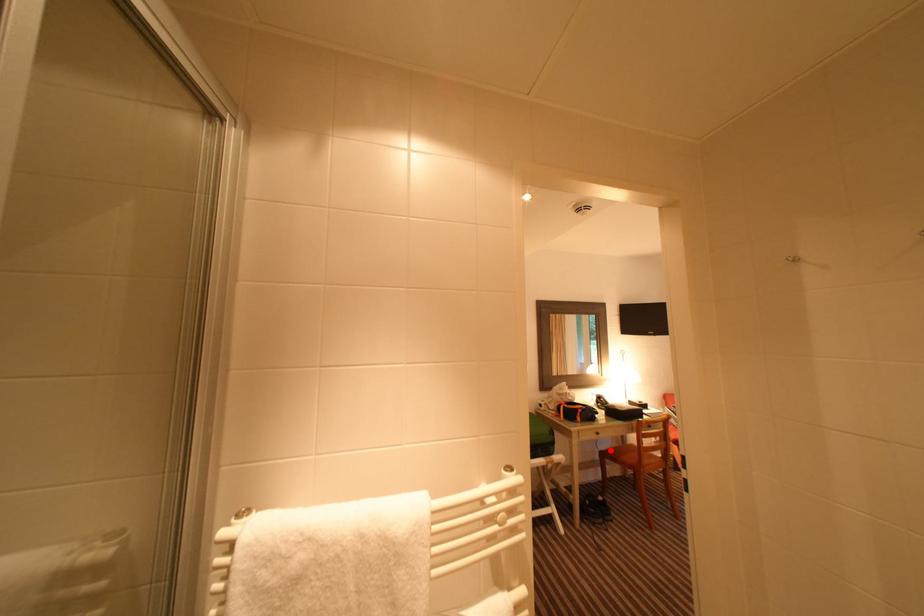
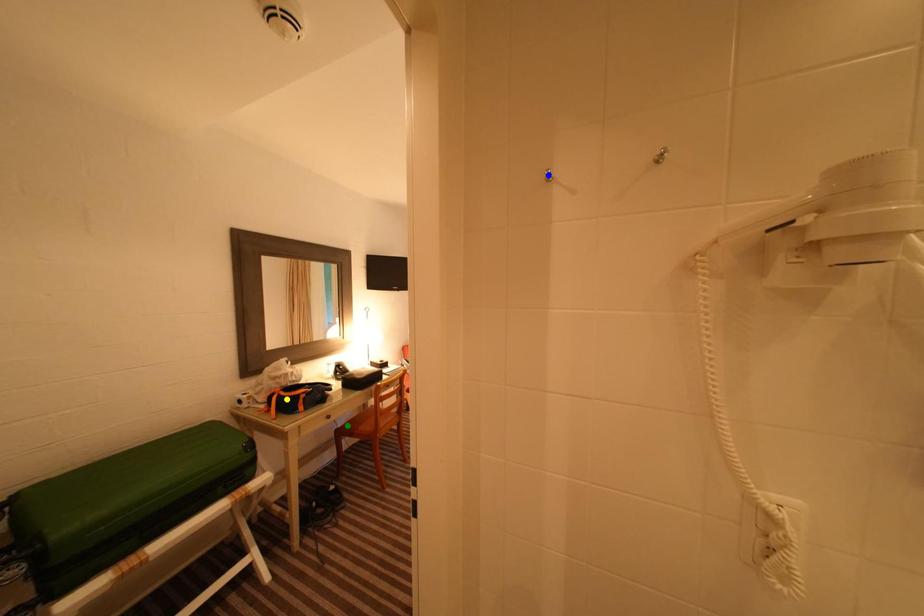
Question: I am providing you with two images of the same scene from different viewpoints. A red point is marked on the first image. You are given multiple points on the second image. Which point in image 2 is actually the same real-world point as the red point in image 1?

Choices:
 (A) green point
 (B) yellow point
 (C) blue point

Answer: (A)